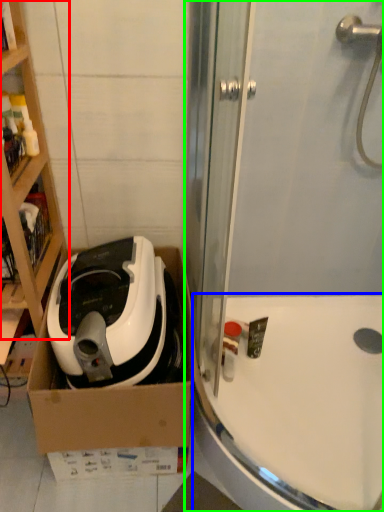
Question: Considering the real-world distances, which object is closest to cabinetry (highlighted by a red box)? bath (highlighted by a blue box) or shower door (highlighted by a green box).

Choices:
 (A) bath
 (B) shower door

Answer: (B)